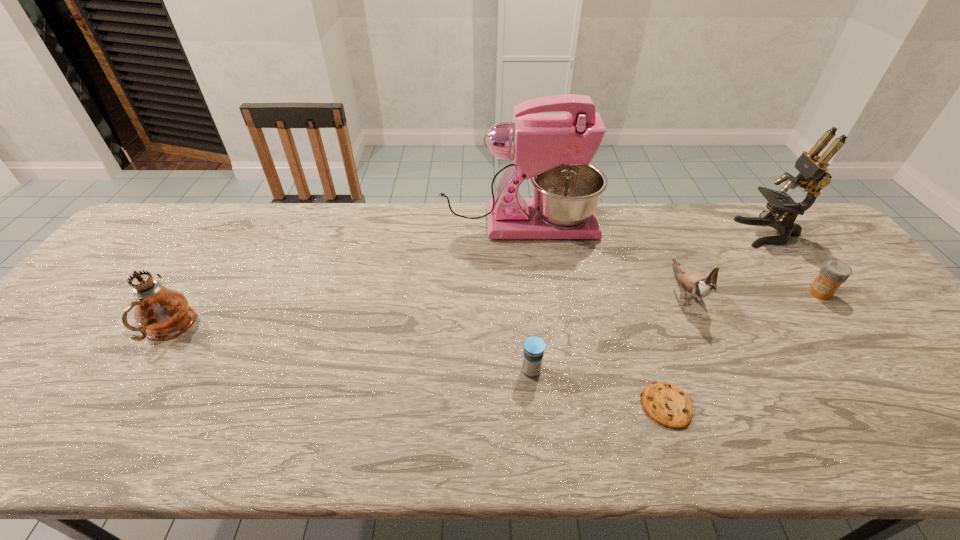
Where is `vacant space at the right edge of the desktop`? Image resolution: width=960 pixels, height=540 pixels. vacant space at the right edge of the desktop is located at coordinates (920, 384).

In the image, there is a desktop. Where is `vacant space at the far left corner`? The width and height of the screenshot is (960, 540). vacant space at the far left corner is located at coordinates (140, 241).

Image resolution: width=960 pixels, height=540 pixels. Find the location of `free space at the far right corner`. free space at the far right corner is located at coordinates (799, 237).

The image size is (960, 540). What are the coordinates of `blank region between the oil lamp and the tallest object` in the screenshot? It's located at (344, 276).

I want to click on free space between the oil lamp and the fifth object from left to right, so click(426, 309).

Identify the location of free space that is in between the fourth tallest object and the nearer medicine. This screenshot has height=540, width=960. (608, 330).

Locate an element on the screen. This screenshot has width=960, height=540. free spot between the mixer and the nearer medicine is located at coordinates (525, 298).

Identify the location of free space between the fifth object from left to right and the sixth farthest object. (608, 330).

Where is `free point between the fourth shortest object and the farther medicine`? Image resolution: width=960 pixels, height=540 pixels. free point between the fourth shortest object and the farther medicine is located at coordinates (753, 292).

Locate an element on the screen. empty space between the sixth farthest object and the right medicine is located at coordinates (676, 332).